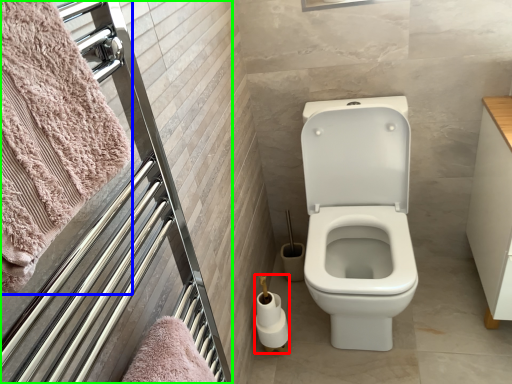
Question: Estimate the real-world distances between objects in this image. Which object is closer to toilet paper (highlighted by a red box), bath towel (highlighted by a blue box) or screen door (highlighted by a green box)?

Choices:
 (A) bath towel
 (B) screen door

Answer: (B)